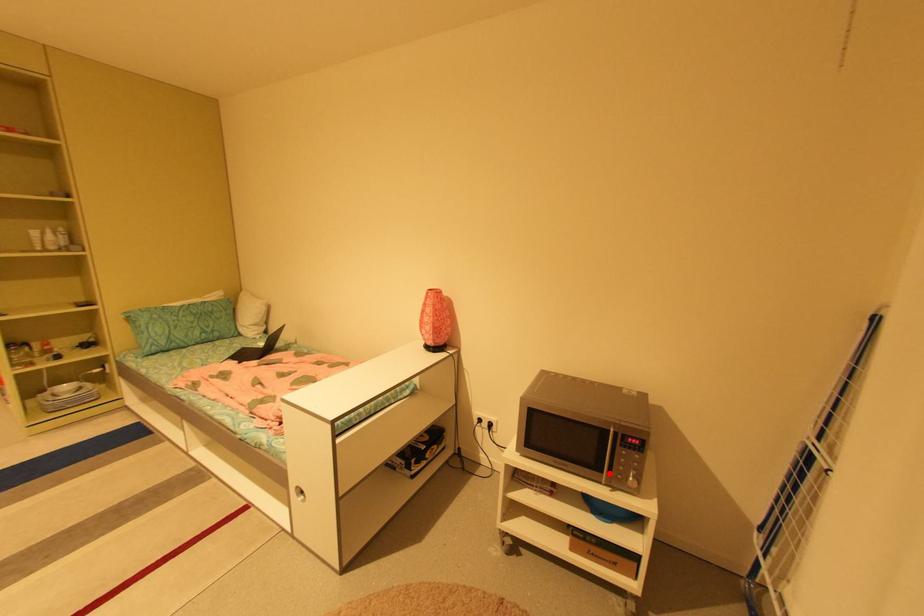
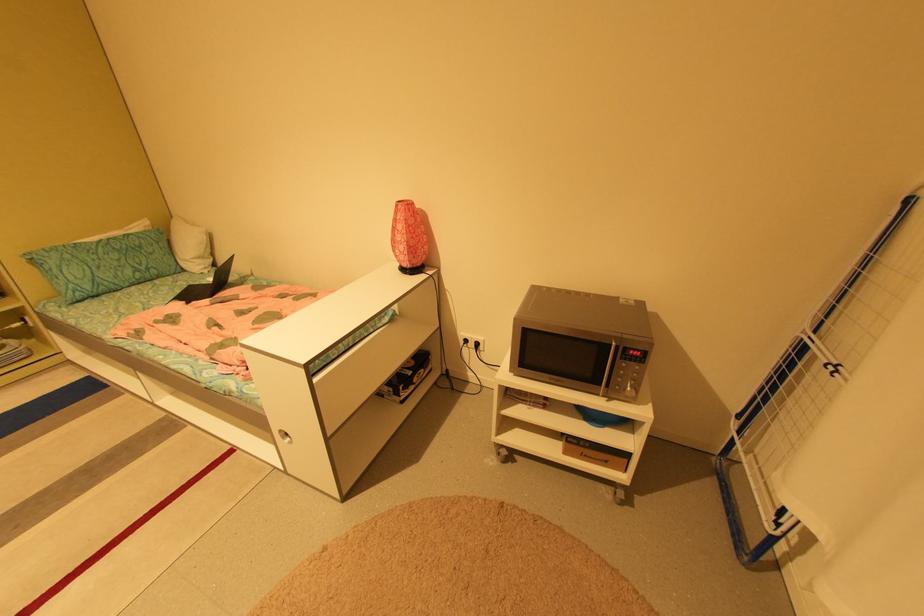
Locate, in the second image, the point that corresponds to the highlighted location in the first image.

(606, 386)